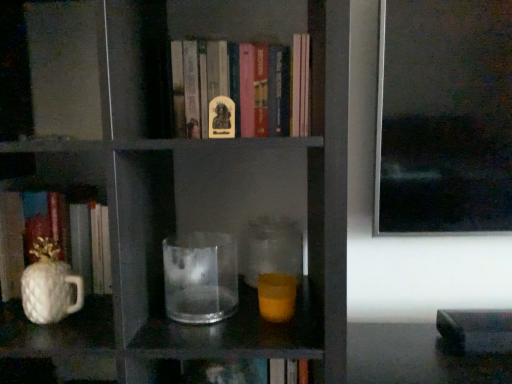
Question: Looking at the image, does white glossy pineapple-shaped object at left, marked as the first book in a bottom-to-top arrangement, seem bigger or smaller compared to translucent glass candle at center?

Choices:
 (A) small
 (B) big

Answer: (B)

Question: Considering the relative positions of white glossy pineapple-shaped object at left, which is counted as the second book, starting from the right, and translucent glass candle at center in the image provided, is white glossy pineapple-shaped object at left, which is counted as the second book, starting from the right, to the left or to the right of translucent glass candle at center?

Choices:
 (A) right
 (B) left

Answer: (B)

Question: Which is nearer to the translucent glass candle at center?

Choices:
 (A) white glossy pineapple-shaped mug at left
 (B) transparent glass at center
 (C) hardcover book at center, marked as the 2th book in a bottom-to-top arrangement
 (D) white glossy pineapple-shaped object at left, which is counted as the 2th book, starting from the top
 (E) transparent glass jar at center

Answer: (B)

Question: Considering the real-world distances, which object is closest to the hardcover book at center, the 1th book viewed from the top?

Choices:
 (A) transparent glass jar at center
 (B) translucent glass candle at center
 (C) transparent glass at center
 (D) white glossy pineapple-shaped mug at left
 (E) white glossy pineapple-shaped object at left, which is counted as the second book, starting from the right

Answer: (A)